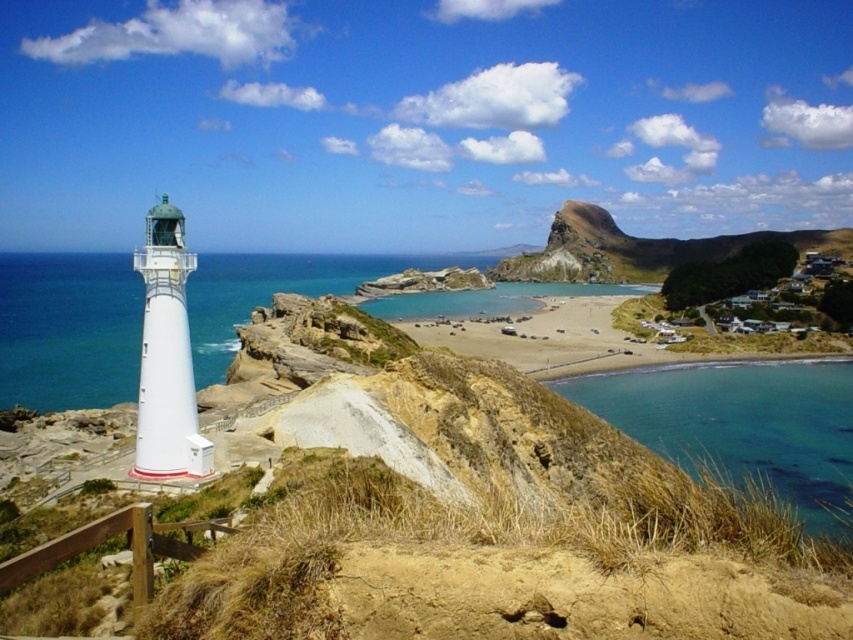
Who is more forward, (781, 422) or (637, 349)?

Point (781, 422) is more forward.

Can you confirm if clear blue water at lower right is positioned below smooth sand beach at center?

Correct, clear blue water at lower right is located below smooth sand beach at center.

Who is more forward, (741,419) or (593,308)?

Point (741,419) is in front.

Find the location of a particular element. clear blue water at lower right is located at coordinates (741, 426).

Is white glossy water at left above clear blue water at lower right?

Correct, white glossy water at left is located above clear blue water at lower right.

Between point (409, 312) and point (840, 429), which one is positioned behind?

The point (409, 312) is more distant.

Is point (10, 272) in front of point (770, 428)?

That is False.

The height and width of the screenshot is (640, 853). What are the coordinates of `white glossy water at left` in the screenshot? It's located at (68, 330).

Is white glossy water at left thinner than smooth sand beach at center?

No, white glossy water at left is not thinner than smooth sand beach at center.

Is point (20, 282) less distant than point (416, 336)?

No, it is behind (416, 336).

Is point (257, 282) positioned behind point (486, 292)?

No, (257, 282) is in front of (486, 292).

Locate an element on the screen. This screenshot has width=853, height=640. white glossy water at left is located at coordinates (68, 330).